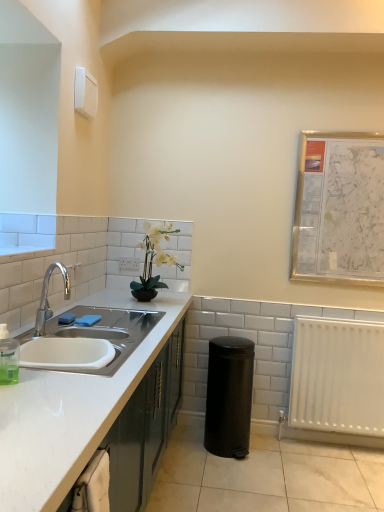
Find the location of a particular element. This screenshot has height=512, width=384. free point above white matte radiator at lower right (from a real-world perspective) is located at coordinates (355, 317).